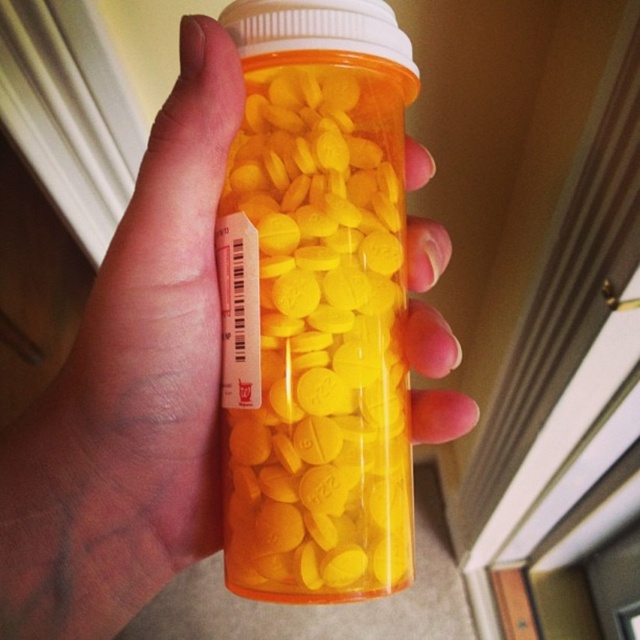
Question: Can you confirm if translucent orange pill bottle at center is bigger than matte plastic hand at center?

Choices:
 (A) yes
 (B) no

Answer: (B)

Question: Which object appears farthest from the camera in this image?

Choices:
 (A) matte plastic hand at center
 (B) translucent orange pill bottle at center

Answer: (B)

Question: Can you confirm if translucent orange pill bottle at center is positioned above matte plastic hand at center?

Choices:
 (A) no
 (B) yes

Answer: (B)

Question: Is translucent orange pill bottle at center closer to the viewer compared to matte plastic hand at center?

Choices:
 (A) yes
 (B) no

Answer: (B)